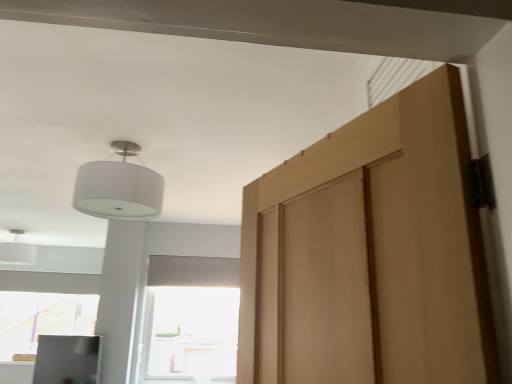
The height and width of the screenshot is (384, 512). What are the coordinates of `white fabric lampshade at upper left` in the screenshot? It's located at (119, 187).

Where is `transparent glass window at center`? transparent glass window at center is located at coordinates (189, 321).

This screenshot has height=384, width=512. What are the coordinates of `white matte lampshade at upper left` in the screenshot? It's located at (17, 251).

Between point (94, 197) and point (0, 257), which one is positioned in front?

Point (94, 197)

Which is more to the left, white fabric lampshade at upper left or white matte lampshade at upper left?

white matte lampshade at upper left is more to the left.

From a real-world perspective, relative to white matte lampshade at upper left, is white fabric lampshade at upper left vertically above or below?

white fabric lampshade at upper left is situated lower than white matte lampshade at upper left in the real world.

From a real-world perspective, does transparent glass window at center stand above white fabric lampshade at upper left?

Actually, transparent glass window at center is physically below white fabric lampshade at upper left in the real world.

Is point (167, 358) farther from viewer compared to point (91, 212)?

Yes, point (167, 358) is behind point (91, 212).

Is transparent glass window at center next to white fabric lampshade at upper left and touching it?

No.

From the image's perspective, which one is positioned higher, white matte lampshade at upper left or white fabric lampshade at upper left?

From the image's view, white fabric lampshade at upper left is above.

Is white matte lampshade at upper left completely or partially outside of white fabric lampshade at upper left?

white matte lampshade at upper left lies outside white fabric lampshade at upper left's area.

Relative to white fabric lampshade at upper left, is white matte lampshade at upper left in front or behind?

In the image, white matte lampshade at upper left appears behind white fabric lampshade at upper left.

Does point (11, 242) come behind point (104, 163)?

That is True.

Is transparent glass window at center to the right of white matte lampshade at upper left from the viewer's perspective?

Indeed, transparent glass window at center is positioned on the right side of white matte lampshade at upper left.

Is transparent glass window at center oriented towards white matte lampshade at upper left?

No, transparent glass window at center does not turn towards white matte lampshade at upper left.

Does point (195, 257) come behind point (35, 255)?

No.

Which of these two, white matte lampshade at upper left or transparent glass window at center, is bigger?

transparent glass window at center is bigger.

Between white matte lampshade at upper left and transparent glass window at center, which one appears on the right side from the viewer's perspective?

Positioned to the right is transparent glass window at center.

Who is taller, white matte lampshade at upper left or transparent glass window at center?

transparent glass window at center.

Would you consider white matte lampshade at upper left to be distant from transparent glass window at center?

white matte lampshade at upper left is far away from transparent glass window at center.

Where is `window located below the white fabric lampshade at upper left (from the image's perspective)`? This screenshot has height=384, width=512. window located below the white fabric lampshade at upper left (from the image's perspective) is located at coordinates (189, 321).

Is white fabric lampshade at upper left facing towards transparent glass window at center?

No, white fabric lampshade at upper left does not turn towards transparent glass window at center.

Considering the sizes of objects white fabric lampshade at upper left and transparent glass window at center in the image provided, who is thinner, white fabric lampshade at upper left or transparent glass window at center?

With smaller width is transparent glass window at center.

In the scene shown: Is white fabric lampshade at upper left smaller than transparent glass window at center?

Correct, white fabric lampshade at upper left occupies less space than transparent glass window at center.

The height and width of the screenshot is (384, 512). What are the coordinates of `lamp beneath the white matte lampshade at upper left (from a real-world perspective)` in the screenshot? It's located at (119, 187).

This screenshot has width=512, height=384. There is a transparent glass window at center. In order to click on lamp above it (from a real-world perspective) in this screenshot , I will do `click(119, 187)`.

Based on the photo, considering their positions, is white matte lampshade at upper left positioned further to transparent glass window at center than white fabric lampshade at upper left?

white matte lampshade at upper left lies further to transparent glass window at center than the other object.

Which object lies nearer to the anchor point white fabric lampshade at upper left, white matte lampshade at upper left or transparent glass window at center?

transparent glass window at center is closer to white fabric lampshade at upper left.

Which object lies further to the anchor point transparent glass window at center, white fabric lampshade at upper left or white matte lampshade at upper left?

Based on the image, white matte lampshade at upper left appears to be further to transparent glass window at center.

Based on their spatial positions, is white fabric lampshade at upper left or transparent glass window at center closer to white matte lampshade at upper left?

Based on the image, transparent glass window at center appears to be nearer to white matte lampshade at upper left.

When comparing their distances from white matte lampshade at upper left, does transparent glass window at center or white fabric lampshade at upper left seem closer?

Based on the image, transparent glass window at center appears to be nearer to white matte lampshade at upper left.

Based on their spatial positions, is transparent glass window at center or white matte lampshade at upper left further from white fabric lampshade at upper left?

Based on the image, white matte lampshade at upper left appears to be further to white fabric lampshade at upper left.

Locate an element on the screen. This screenshot has height=384, width=512. window between white fabric lampshade at upper left and white matte lampshade at upper left from front to back is located at coordinates (189, 321).